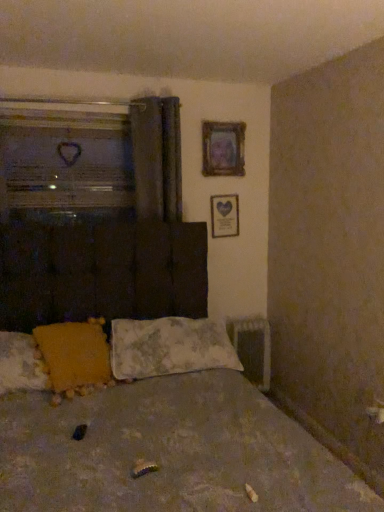
Question: From a real-world perspective, is fluffy white pillow at center, which is counted as the 2th pillow, starting from the left, physically located above or below wooden heart-shaped frame at upper right, the first picture frame ordered from the bottom?

Choices:
 (A) below
 (B) above

Answer: (A)

Question: Is point (188, 366) positioned closer to the camera than point (216, 200)?

Choices:
 (A) closer
 (B) farther

Answer: (A)

Question: Estimate the real-world distances between objects in this image. Which object is closer to the fluffy white pillow at center, which is counted as the 2th pillow, starting from the left?

Choices:
 (A) dark gray fabric curtain at upper center
 (B) transparent glass heart at upper left
 (C) wooden heart-shaped frame at upper right, which appears as the 2th picture frame when viewed from the top
 (D) textured fabric bed at center
 (E) yellow fabric pillow at lower left, which is counted as the first pillow, starting from the left

Answer: (D)

Question: Estimate the real-world distances between objects in this image. Which object is farther from the transparent glass heart at upper left?

Choices:
 (A) fluffy white pillow at center, which is counted as the 2th pillow, starting from the left
 (B) yellow fabric pillow at lower left, which is counted as the first pillow, starting from the left
 (C) textured fabric bed at center
 (D) wooden heart-shaped frame at upper right, which appears as the 2th picture frame when viewed from the top
 (E) dark gray fabric curtain at upper center

Answer: (C)